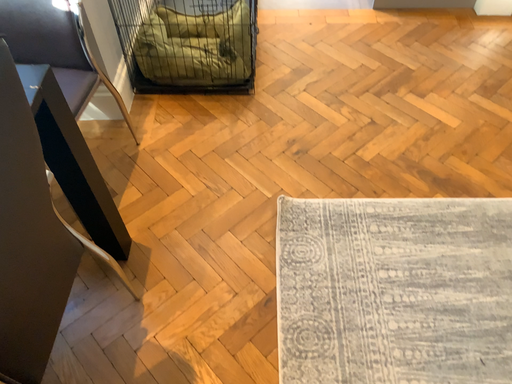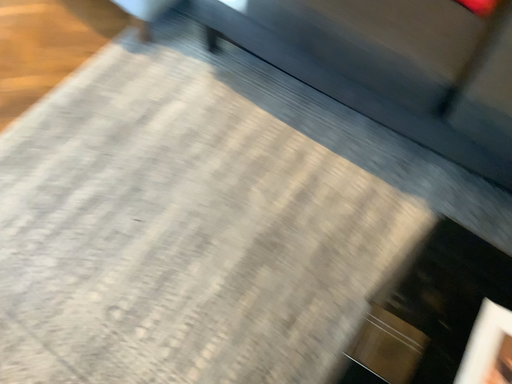
Question: Which way did the camera rotate in the video?

Choices:
 (A) rotated left
 (B) rotated right

Answer: (B)